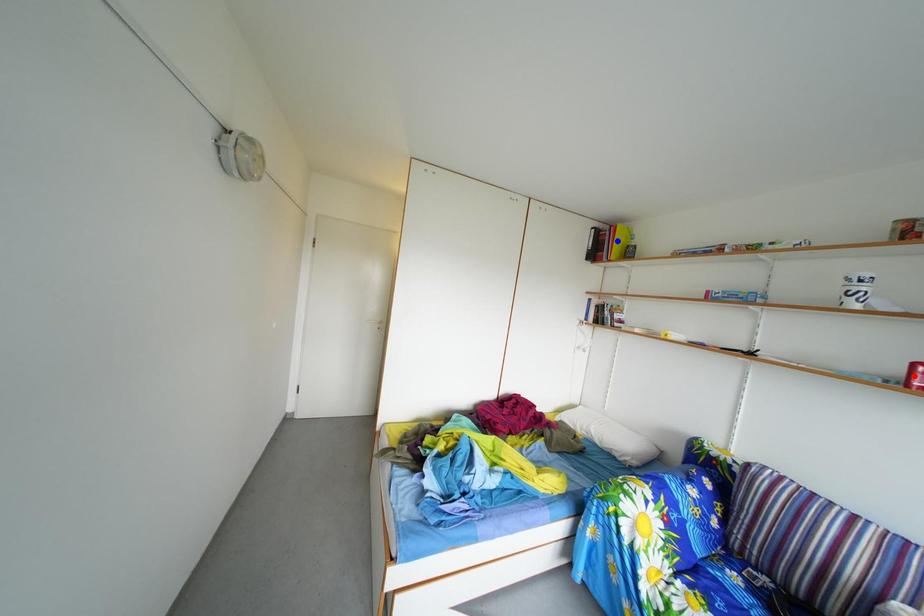
Question: Which of the two points in the image is closer to the camera?

Choices:
 (A) Blue point is closer.
 (B) Red point is closer.

Answer: (B)